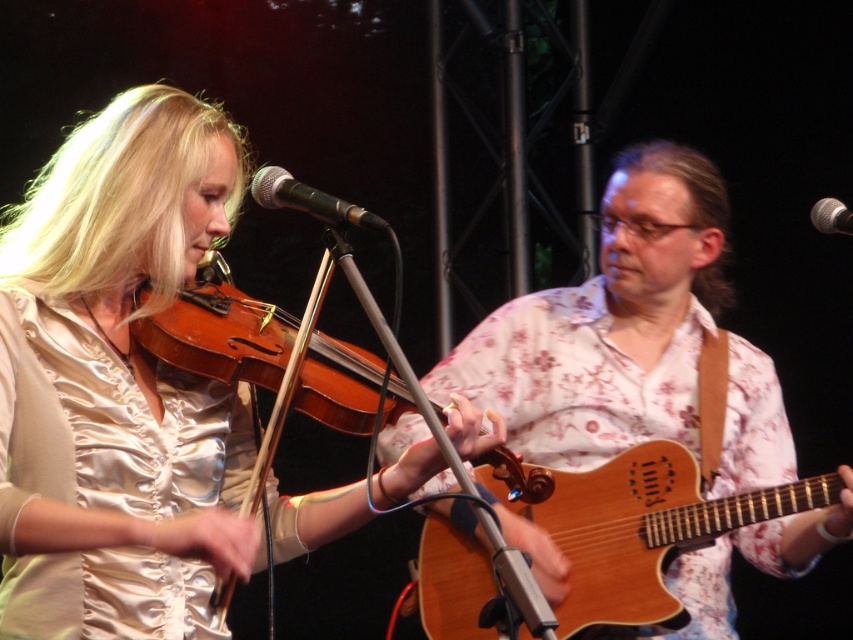
Does metallic silver microphone at center lie in front of black metallic microphone at center?

Yes, metallic silver microphone at center is closer to the viewer.

Is metallic silver microphone at center smaller than black metallic microphone at center?

No, metallic silver microphone at center is not smaller than black metallic microphone at center.

Is point (341, 209) farther from viewer compared to point (813, 205)?

No, it is in front of (813, 205).

Image resolution: width=853 pixels, height=640 pixels. In order to click on metallic silver microphone at center in this screenshot , I will do `click(308, 198)`.

Is wooden acoustic guitar at center to the right of black metallic microphone at center from the viewer's perspective?

Incorrect, wooden acoustic guitar at center is not on the right side of black metallic microphone at center.

Identify the location of wooden acoustic guitar at center. Image resolution: width=853 pixels, height=640 pixels. (608, 323).

Who is positioned more to the right, wooden violin at center or black metallic microphone at center?

black metallic microphone at center

Between wooden violin at center and black metallic microphone at center, which one has less height?

Standing shorter between the two is black metallic microphone at center.

Is point (404, 397) closer to viewer compared to point (833, 196)?

That is True.

This screenshot has width=853, height=640. Find the location of `wooden violin at center`. wooden violin at center is located at coordinates (219, 333).